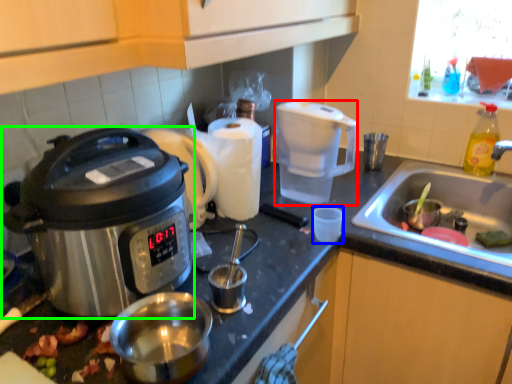
Question: Which object is positioned farthest from coffee maker (highlighted by a red box)? Select from coffee cup (highlighted by a blue box) and slow cooker (highlighted by a green box).

Choices:
 (A) coffee cup
 (B) slow cooker

Answer: (B)